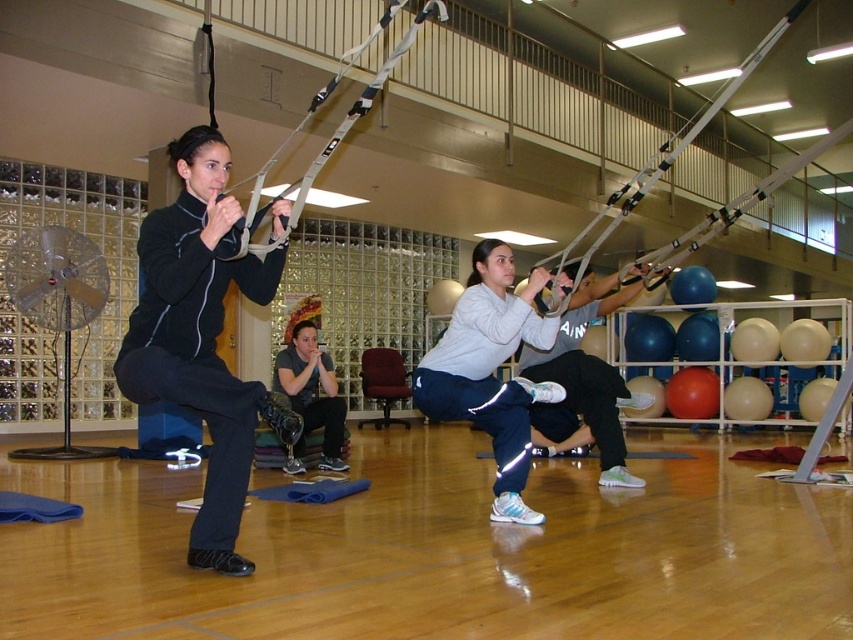
Question: Can you confirm if white matte athletic pants at center is smaller than matte black prosthetic leg at center?

Choices:
 (A) yes
 (B) no

Answer: (B)

Question: Does white matte athletic pants at center have a lesser width compared to white matte squat at center?

Choices:
 (A) yes
 (B) no

Answer: (A)

Question: Which point appears closest to the camera in this image?

Choices:
 (A) (277, 371)
 (B) (525, 360)
 (C) (561, 280)

Answer: (C)

Question: Is white matte athletic pants at center above matte black prosthetic leg at center?

Choices:
 (A) yes
 (B) no

Answer: (A)

Question: Among these points, which one is farthest from the camera?

Choices:
 (A) click(x=448, y=413)
 (B) click(x=317, y=408)
 (C) click(x=647, y=397)

Answer: (B)

Question: Based on their relative distances, which object is nearer to the white matte squat at center?

Choices:
 (A) white matte athletic pants at center
 (B) matte black prosthetic leg at center

Answer: (A)